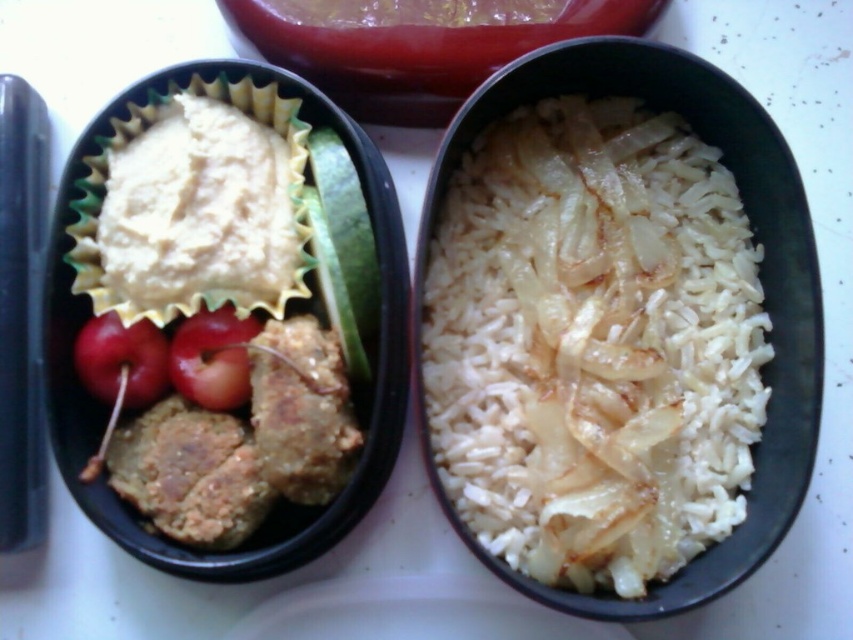
Is white matte rice at right closer to the viewer compared to red shiny cherry at left?

That is True.

Consider the image. Who is taller, white matte rice at right or red shiny cherry at left?

With more height is white matte rice at right.

The height and width of the screenshot is (640, 853). I want to click on white matte rice at right, so click(x=593, y=342).

Consider the image. Measure the distance from white matte rice at right to red matte cherry at center.

The distance of white matte rice at right from red matte cherry at center is 48.33 centimeters.

Is point (450, 369) closer to viewer compared to point (233, 372)?

No.

At what (x,y) coordinates should I click in order to perform the action: click on white matte rice at right. Please return your answer as a coordinate pair (x, y). The height and width of the screenshot is (640, 853). Looking at the image, I should click on (593, 342).

Is point (131, 390) positioned after point (228, 355)?

No, it is in front of (228, 355).

Who is higher up, red shiny cherry at left or red matte cherry at center?

Positioned higher is red matte cherry at center.

Locate an element on the screen. red shiny cherry at left is located at coordinates (120, 360).